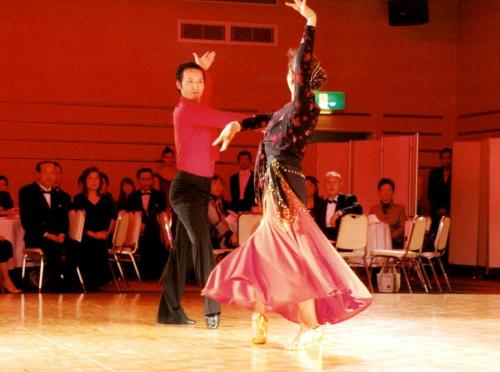
Find the location of a particular element. This screenshot has height=372, width=500. table cloth is located at coordinates (9, 228).